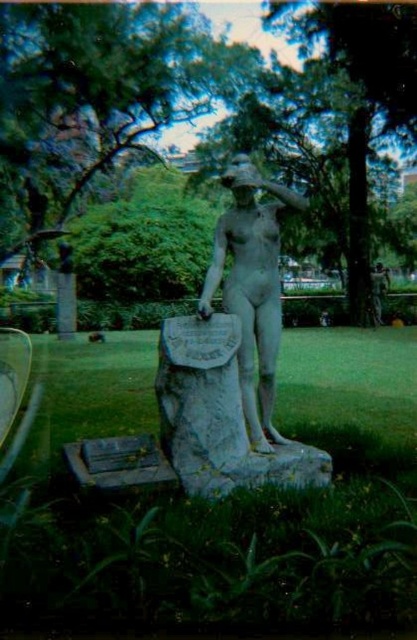
You are a GUI agent. You are given a task and a screenshot of the screen. Output one action in this format:
    pyautogui.click(x=<x>, y=<y>)
    Task: Click on the matte stone statue at center
    Image resolution: width=417 pixels, height=640 pixels.
    Given the screenshot: What is the action you would take?
    pyautogui.click(x=233, y=358)

Consider the image. Who is more forward, (220, 262) or (118, 451)?

Point (118, 451) is in front.

This screenshot has height=640, width=417. Identify the location of matte stone statue at center. (233, 358).